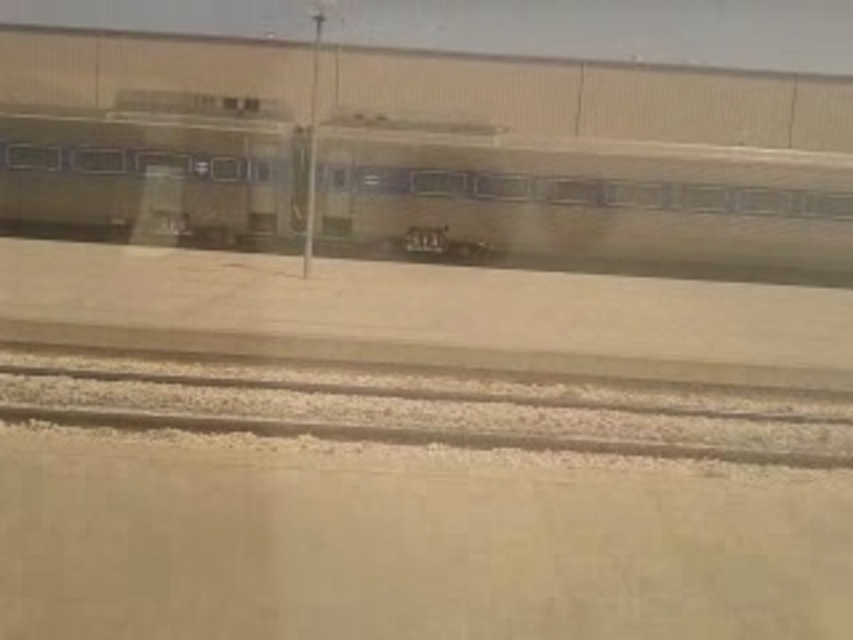
Based on the photo, can you confirm if green matte train at center is wider than gray gravel track at bottom?

Indeed, green matte train at center has a greater width compared to gray gravel track at bottom.

Between green matte train at center and gray gravel track at bottom, which one appears on the right side from the viewer's perspective?

Positioned to the right is gray gravel track at bottom.

Is point (409, 198) in front of point (364, 394)?

That is False.

At what (x,y) coordinates should I click in order to perform the action: click on green matte train at center. Please return your answer as a coordinate pair (x, y). The width and height of the screenshot is (853, 640). Looking at the image, I should click on (579, 204).